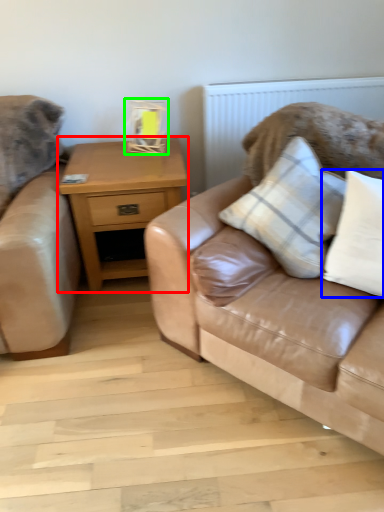
Question: Estimate the real-world distances between objects in this image. Which object is farther from nightstand (highlighted by a red box), pillow (highlighted by a blue box) or table lamp (highlighted by a green box)?

Choices:
 (A) pillow
 (B) table lamp

Answer: (A)